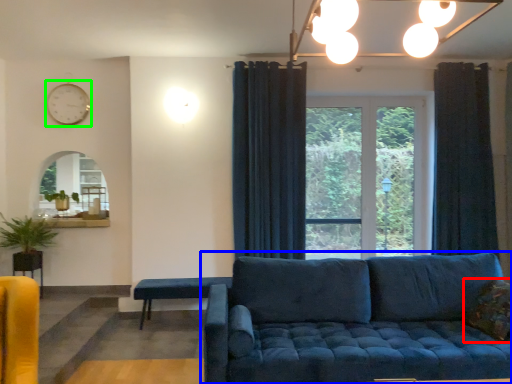
Question: Which object is the closest to the pillow (highlighted by a red box)? Choose among these: studio couch (highlighted by a blue box) or clock (highlighted by a green box).

Choices:
 (A) studio couch
 (B) clock

Answer: (A)